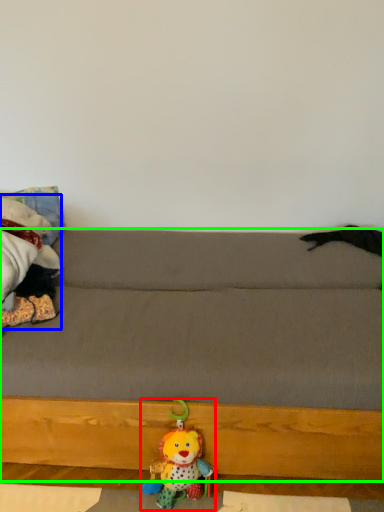
Question: Based on their relative distances, which object is farther from toy (highlighted by a red box)? Choose from toy (highlighted by a blue box) and studio couch (highlighted by a green box).

Choices:
 (A) toy
 (B) studio couch

Answer: (A)